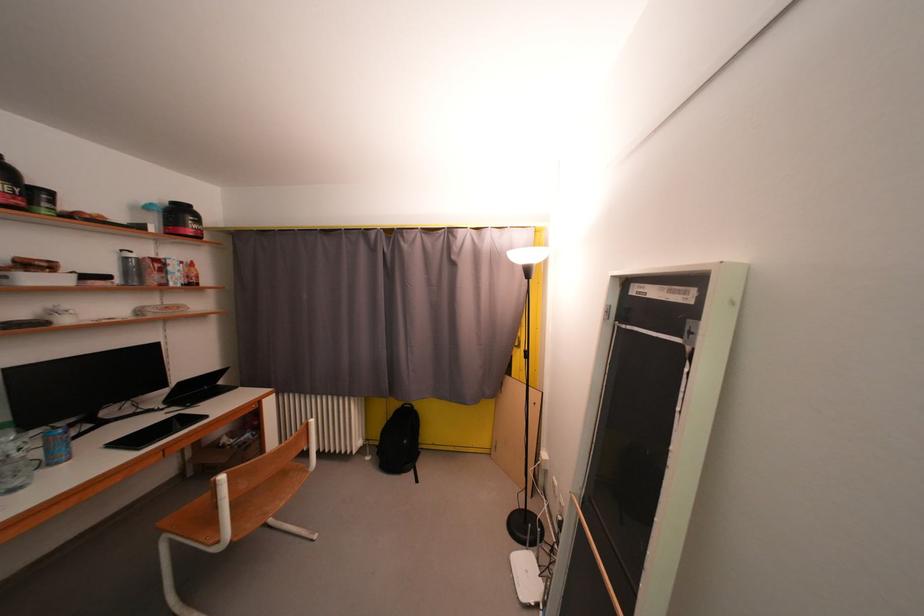
Locate an element on the screen. black laptop is located at coordinates click(197, 389).